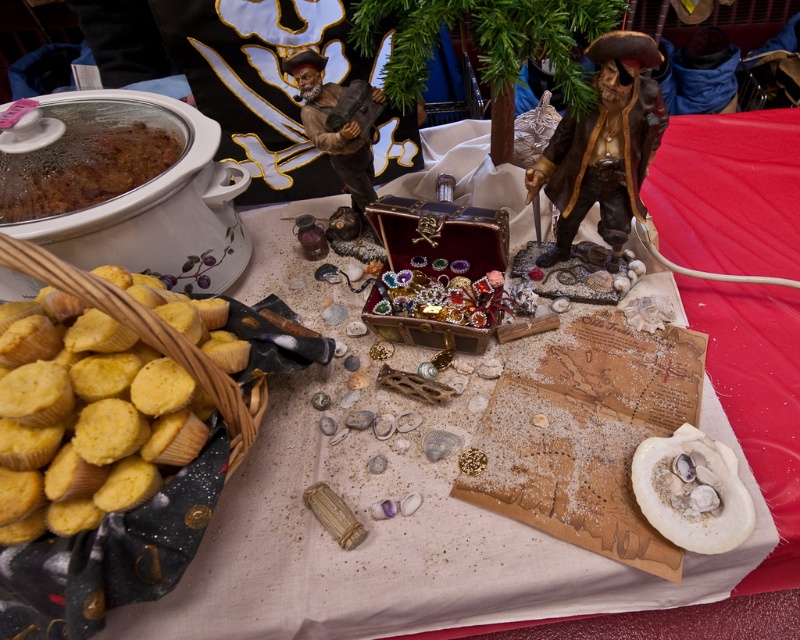
Question: From the image, what is the correct spatial relationship of matte brown pirate at center in relation to brown matte chili at upper left?

Choices:
 (A) below
 (B) above

Answer: (A)

Question: Observing the image, what is the correct spatial positioning of white shell at center in reference to matte brown wood pirate at center?

Choices:
 (A) left
 (B) right

Answer: (B)

Question: Which object is closer to the camera taking this photo?

Choices:
 (A) white shell at center
 (B) matte brown wood pirate at center

Answer: (A)

Question: Does matte brown pirate at center appear on the left side of white shell at center?

Choices:
 (A) yes
 (B) no

Answer: (A)

Question: Which point appears closest to the camera in this image?

Choices:
 (A) (141, 474)
 (B) (344, 157)
 (C) (44, 200)

Answer: (A)

Question: Which of the following is the closest to the observer?

Choices:
 (A) matte brown pirate at center
 (B) yellow paper muffins at lower left

Answer: (B)